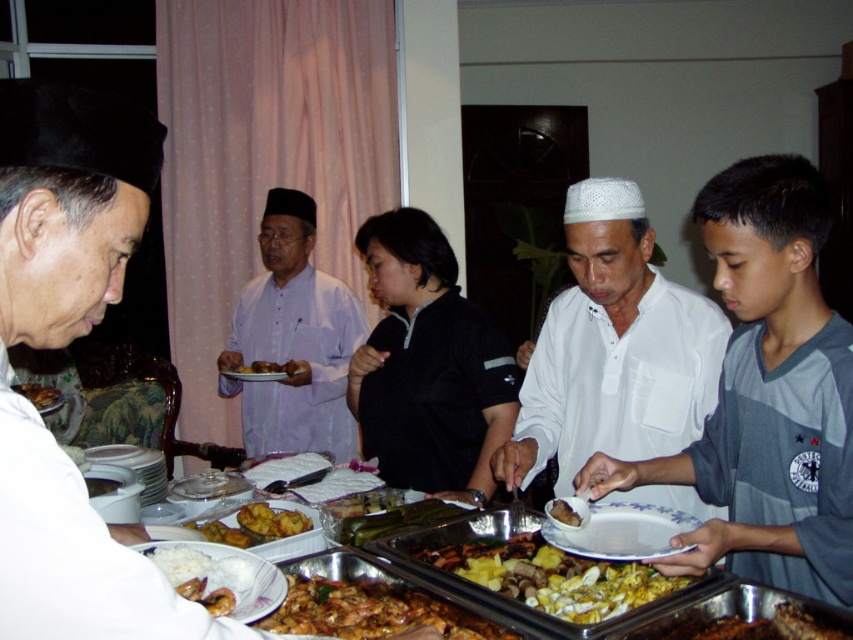
You are a guest at this communal meal and want to reach both the golden crispy fried chicken at center and the golden brown fried chicken at center. If you can only move forward in a straight line from your current position, which chicken will you reach first?

The golden crispy fried chicken at center and golden brown fried chicken at center are both at the center of the table, so you will reach them at the same time.